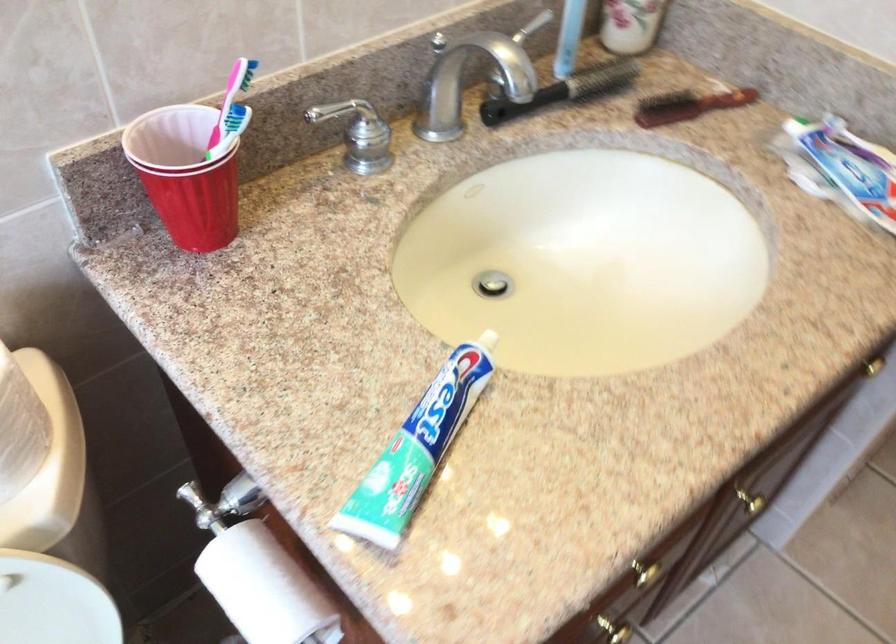
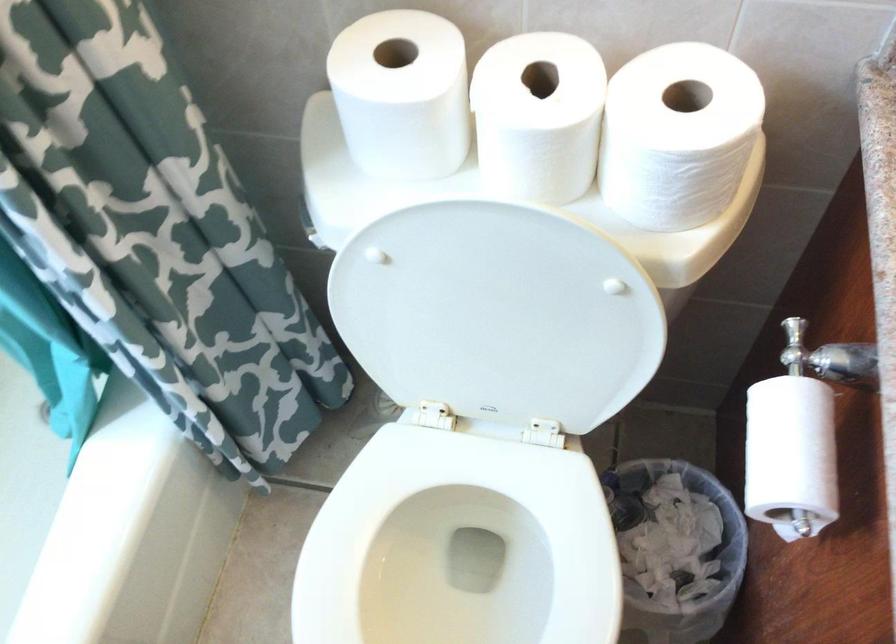
How did the camera likely rotate?

The camera rotated toward left-down.